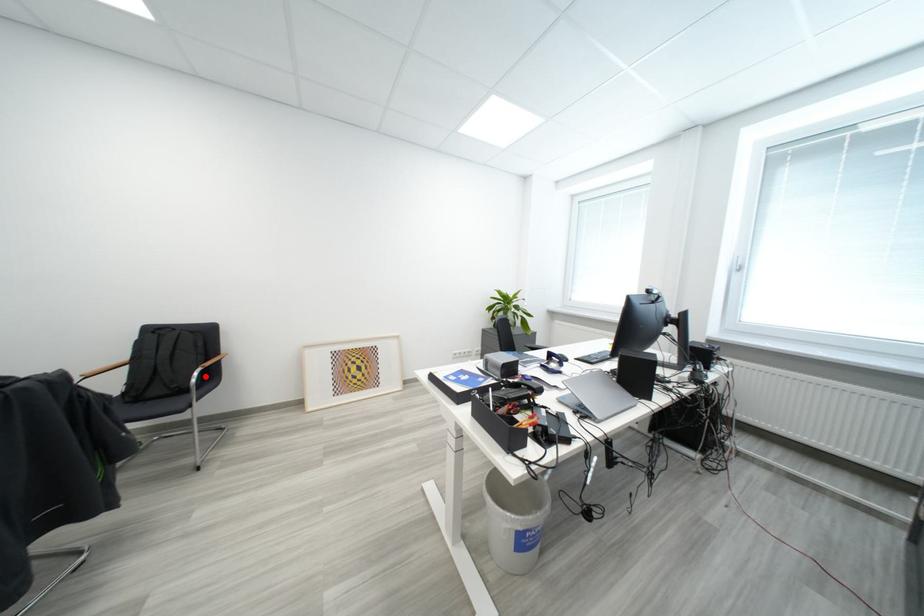
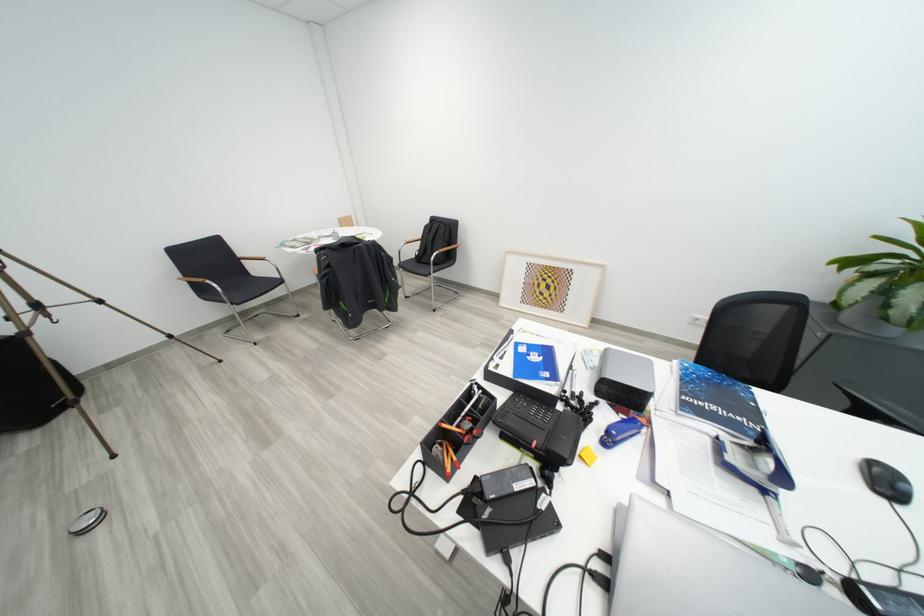
Question: I am providing you with two images of the same scene from different viewpoints. A red point is shown in image1. For the corresponding object point in image2, is it positioned nearer or farther from the camera?

Choices:
 (A) Nearer
 (B) Farther

Answer: (A)